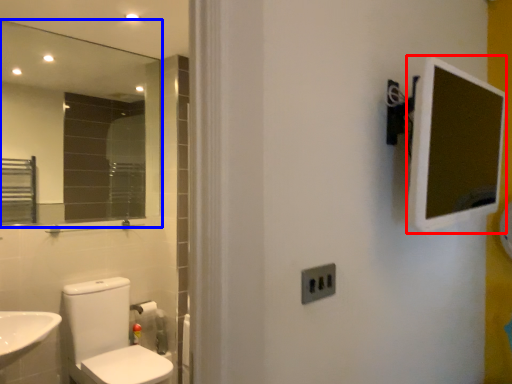
Question: Which object is further to the camera taking this photo, medicine cabinet (highlighted by a red box) or mirror (highlighted by a blue box)?

Choices:
 (A) medicine cabinet
 (B) mirror

Answer: (B)